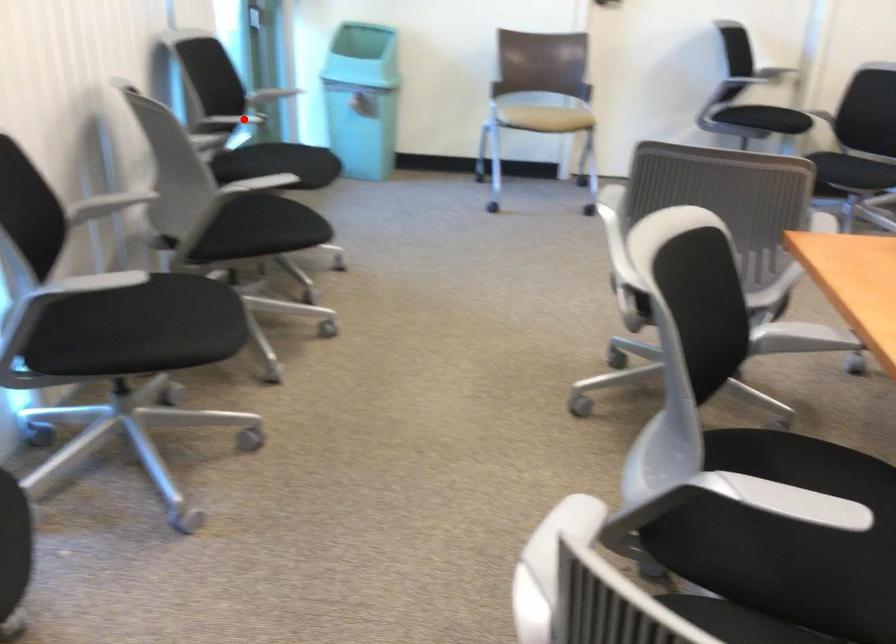
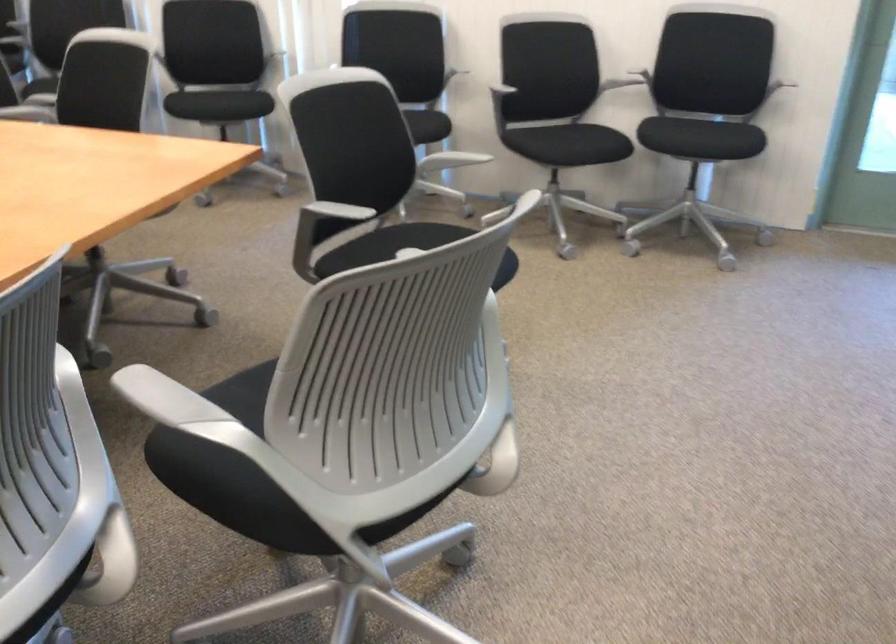
In the second image, find the point that corresponds to the highlighted location in the first image.

(778, 86)